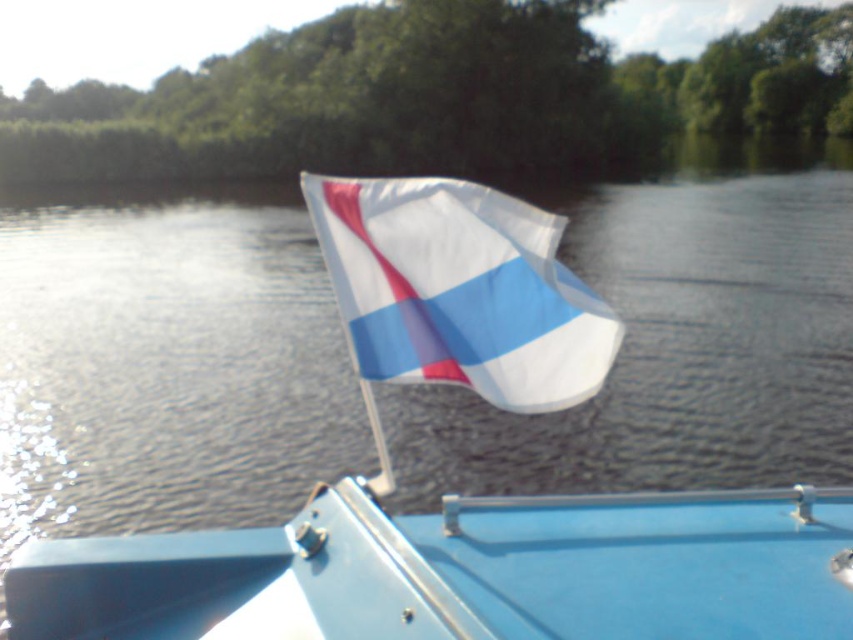
Does blue matte boat at center have a lesser width compared to white fabric flag at center?

Incorrect, blue matte boat at center's width is not less than white fabric flag at center's.

Between point (544, 522) and point (500, 355), which one is positioned behind?

The point (544, 522) is behind.

What are the coordinates of `blue matte boat at center` in the screenshot? It's located at (461, 572).